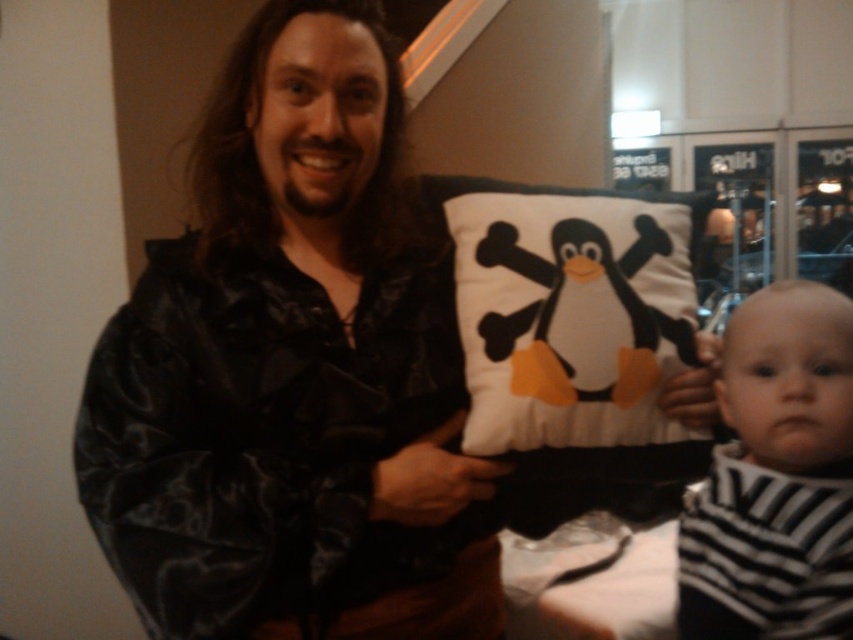
Is point (534, 288) farther from viewer compared to point (805, 465)?

Yes, it is behind point (805, 465).

Can you confirm if white fabric pillow at center is positioned above black and white striped bib at lower right?

Correct, white fabric pillow at center is located above black and white striped bib at lower right.

This screenshot has width=853, height=640. Identify the location of white fabric pillow at center. (572, 312).